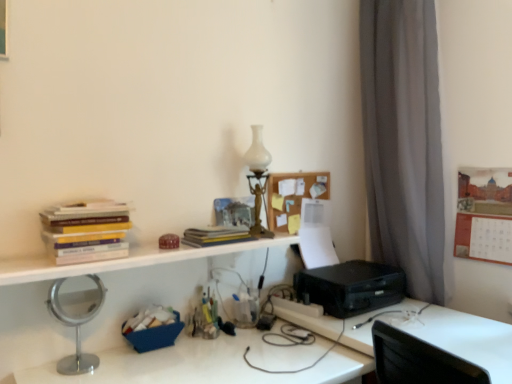
The image size is (512, 384). What are the coordinates of `vacant area that is in front of translucent plastic container at center, which is the 2th stationery in bottom-to-top order` in the screenshot? It's located at (207, 353).